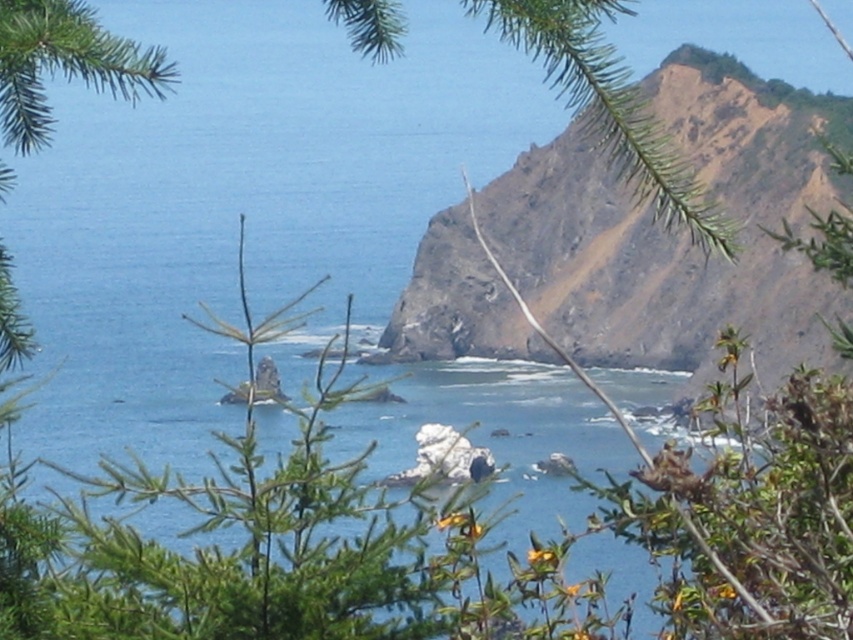
Question: Which point is closer to the camera taking this photo?

Choices:
 (A) (845, 113)
 (B) (431, 444)

Answer: (B)

Question: Can you confirm if green leafy tree at center is bigger than white rock at center?

Choices:
 (A) yes
 (B) no

Answer: (A)

Question: Which object is the closest to the green leafy tree at center?

Choices:
 (A) rusty rock cliff at upper right
 (B) white rock at center

Answer: (B)

Question: Can you confirm if green leafy tree at center is positioned below white rock at center?

Choices:
 (A) yes
 (B) no

Answer: (B)

Question: Which object is positioned farthest from the rusty rock cliff at upper right?

Choices:
 (A) white rock at center
 (B) green leafy tree at center

Answer: (B)

Question: Does rusty rock cliff at upper right have a greater width compared to white rock at center?

Choices:
 (A) yes
 (B) no

Answer: (A)